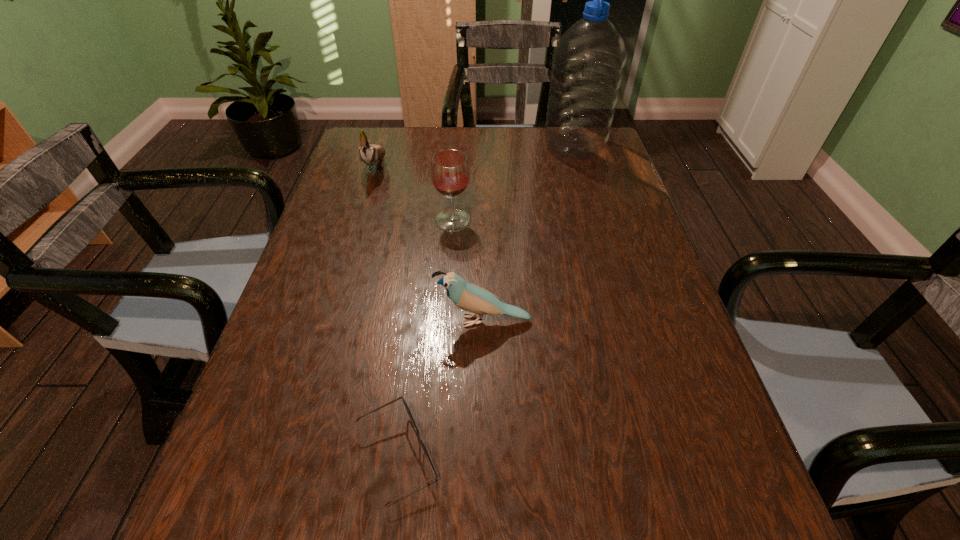
You are a GUI agent. You are given a task and a screenshot of the screen. Output one action in this format:
    pyautogui.click(x=<x>, y=<y>)
    Task: Click on the free spot between the farther bird and the tallest object
    Image resolution: width=960 pixels, height=540 pixels.
    Given the screenshot: What is the action you would take?
    pyautogui.click(x=475, y=156)

This screenshot has width=960, height=540. Identify the location of blank region between the shortest object and the leftmost object. (387, 311).

Image resolution: width=960 pixels, height=540 pixels. In order to click on vacant area that lies between the fourth farthest object and the shortest object in this screenshot , I will do `click(441, 388)`.

The height and width of the screenshot is (540, 960). What are the coordinates of `free space between the left bird and the wineglass` in the screenshot? It's located at coord(415,193).

Where is `free space between the right bird and the rightmost object`? free space between the right bird and the rightmost object is located at coordinates (529, 234).

You are a GUI agent. You are given a task and a screenshot of the screen. Output one action in this format:
    pyautogui.click(x=<x>, y=<y>)
    Task: Click on the empty space between the left bird and the wineglass
    The width and height of the screenshot is (960, 540).
    Given the screenshot: What is the action you would take?
    pyautogui.click(x=415, y=193)

Identify the location of free space between the third farthest object and the tallest object. (514, 184).

At what (x,y) coordinates should I click in order to perform the action: click on object that is the second closest to the shortest object. Please return your answer as a coordinate pair (x, y). This screenshot has height=540, width=960. Looking at the image, I should click on 450,172.

Locate an element on the screen. object that is the second nearest to the right bird is located at coordinates (450, 172).

I want to click on free space that satisfies the following two spatial constraints: 1. at the face of the third farthest object; 2. on the right side of the farther bird, so click(x=360, y=220).